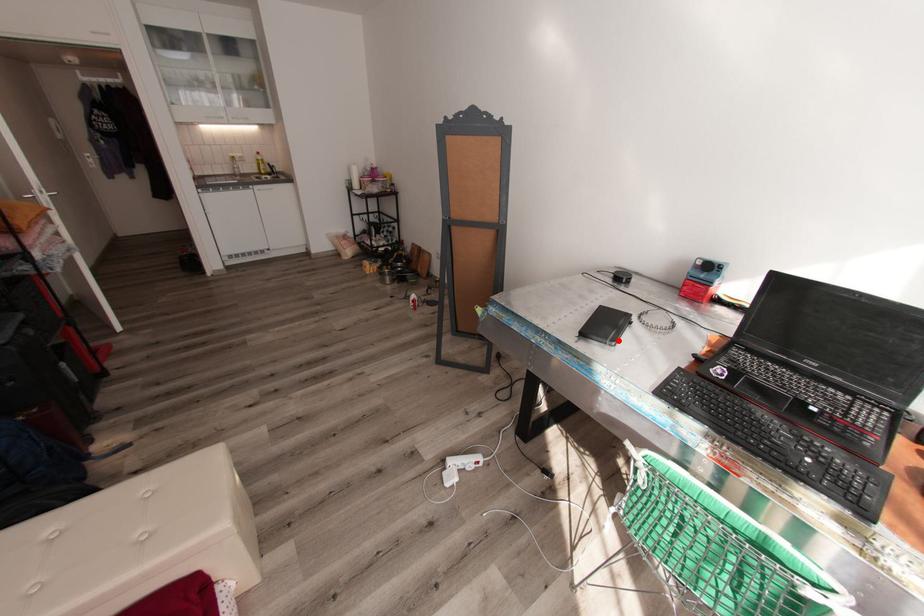
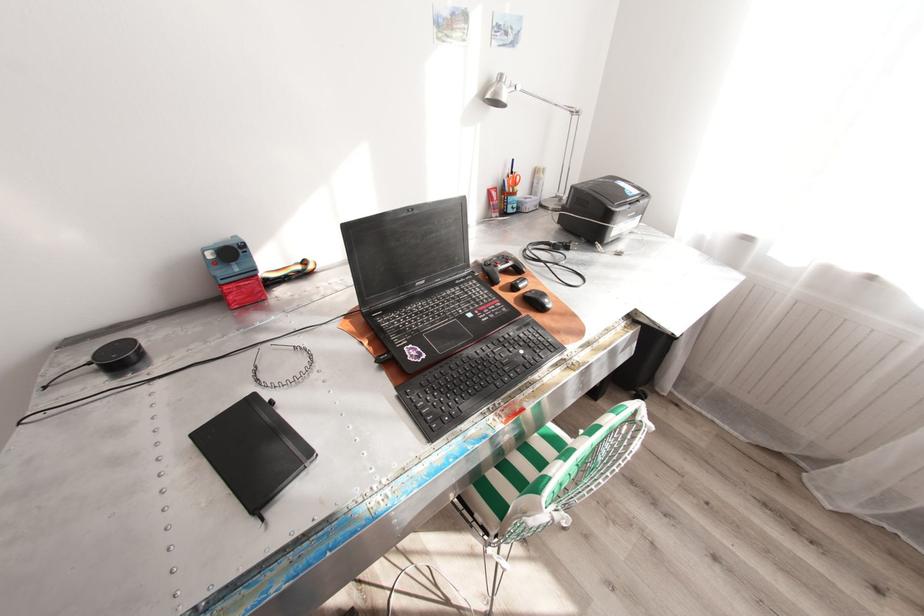
Question: I am providing you with two images of the same scene from different viewpoints. A red point is marked on the first image. At the location where the point appears in image 1, is it still visible in image 2?

Choices:
 (A) Yes
 (B) No

Answer: (A)